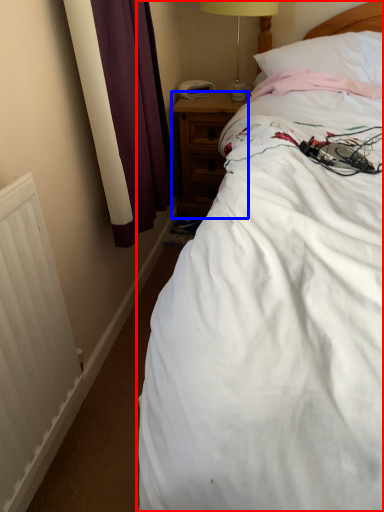
Question: Which of the following is the farthest to the observer, bed (highlighted by a red box) or nightstand (highlighted by a blue box)?

Choices:
 (A) bed
 (B) nightstand

Answer: (B)